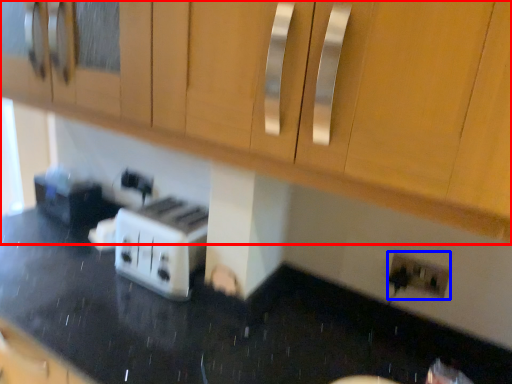
Question: Which of the following is the farthest to the observer, cabinetry (highlighted by a red box) or electric outlet (highlighted by a blue box)?

Choices:
 (A) cabinetry
 (B) electric outlet

Answer: (B)